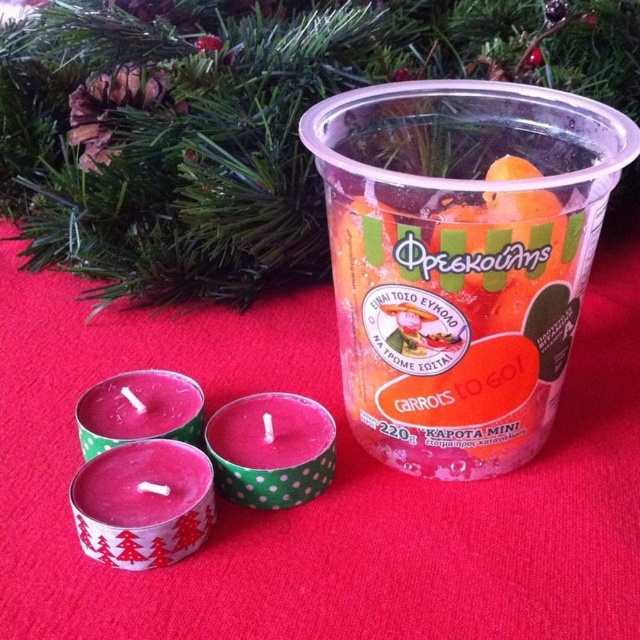
Does matte pink candle at lower left have a larger size compared to pink polka dot candle at center?

No.

Is matte pink candle at lower left above pink polka dot candle at center?

No.

The image size is (640, 640). Identify the location of matte pink candle at lower left. (144, 502).

Does translucent plastic cup at center have a greater width compared to matte pink candle at lower left?

Yes.

Measure the distance between point (381, 442) and camera.

A distance of 98.88 centimeters exists between point (381, 442) and camera.

The height and width of the screenshot is (640, 640). I want to click on translucent plastic cup at center, so click(456, 317).

Is point (193, 468) closer to camera compared to point (186, 417)?

Yes, it is in front of point (186, 417).

Who is more forward, (120, 464) or (180, 436)?

Point (120, 464) is in front.

Between point (100, 518) and point (113, 417), which one is positioned in front?

Positioned in front is point (100, 518).

This screenshot has width=640, height=640. In order to click on matte pink candle at lower left in this screenshot , I will do coord(144,502).